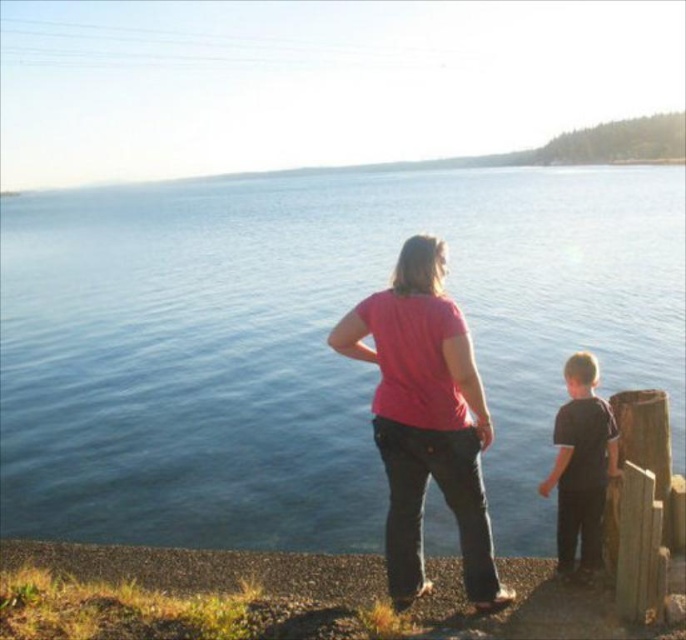
Between point (200, 520) and point (580, 416), which one is positioned in front?

Point (580, 416) is more forward.

Can you confirm if blue water at center is thinner than dark brown fabric shirt at right?

In fact, blue water at center might be wider than dark brown fabric shirt at right.

Which is in front, point (571, 200) or point (556, 429)?

Point (556, 429) is more forward.

The image size is (686, 640). Identify the location of blue water at center. (307, 342).

Does point (176, 394) come closer to viewer compared to point (434, 349)?

No.

Is blue water at center to the right of pink matte shirt at center from the viewer's perspective?

In fact, blue water at center is to the left of pink matte shirt at center.

Between point (362, 403) and point (436, 364), which one is positioned behind?

Positioned behind is point (362, 403).

You are a GUI agent. You are given a task and a screenshot of the screen. Output one action in this format:
    pyautogui.click(x=<x>, y=<y>)
    Task: Click on the blue water at center
    
    Given the screenshot: What is the action you would take?
    pyautogui.click(x=307, y=342)

Between pink matte shirt at center and dark brown fabric shirt at right, which one is positioned higher?

Positioned higher is pink matte shirt at center.

This screenshot has height=640, width=686. What do you see at coordinates (425, 419) in the screenshot?
I see `pink matte shirt at center` at bounding box center [425, 419].

Does point (414, 515) come behind point (606, 422)?

No, (414, 515) is closer to viewer.

This screenshot has height=640, width=686. I want to click on pink matte shirt at center, so click(x=425, y=419).